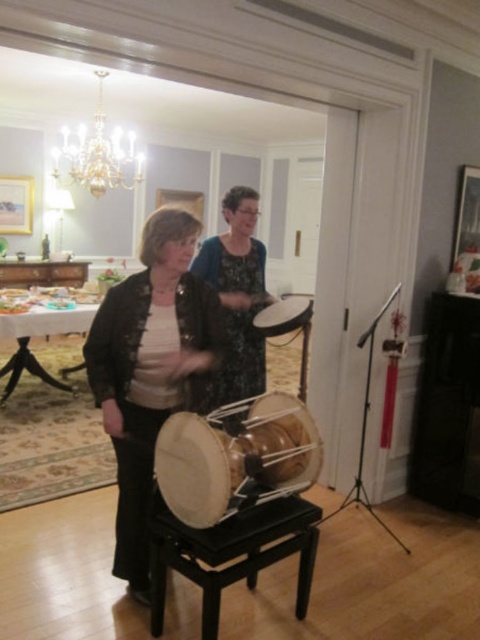
Consider the image. Is wooden drum at center behind crystal glass chandelier at upper left?

No.

Between point (297, 436) and point (87, 180), which one is positioned behind?

Point (87, 180)

Locate an element on the screen. The image size is (480, 640). wooden drum at center is located at coordinates (280, 442).

How distant is matte black jacket at center from black wood stool at center?

matte black jacket at center is 50.05 centimeters from black wood stool at center.

From the picture: Between matte black jacket at center and black wood stool at center, which one has less height?

With less height is black wood stool at center.

Is point (140, 396) closer to camera compared to point (214, 593)?

No, it is behind (214, 593).

At what (x,y) coordinates should I click in order to perform the action: click on matte black jacket at center. Please return your answer as a coordinate pair (x, y). This screenshot has width=480, height=640. Looking at the image, I should click on (149, 369).

This screenshot has height=640, width=480. I want to click on matte black jacket at center, so click(149, 369).

Does matte black jacket at center have a lesser height compared to light brown wooden drum at center?

No, matte black jacket at center is not shorter than light brown wooden drum at center.

Between point (148, 221) and point (168, 449), which one is positioned in front?

Point (168, 449) is in front.

Where is `matte black jacket at center`? Image resolution: width=480 pixels, height=640 pixels. matte black jacket at center is located at coordinates (149, 369).